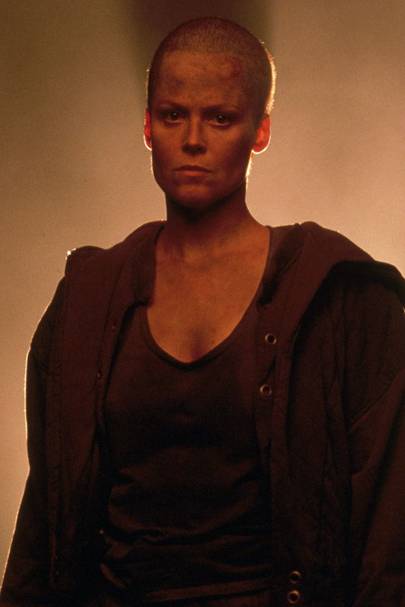
The width and height of the screenshot is (405, 607). What are the coordinates of `chest` in the screenshot? It's located at (200, 291).